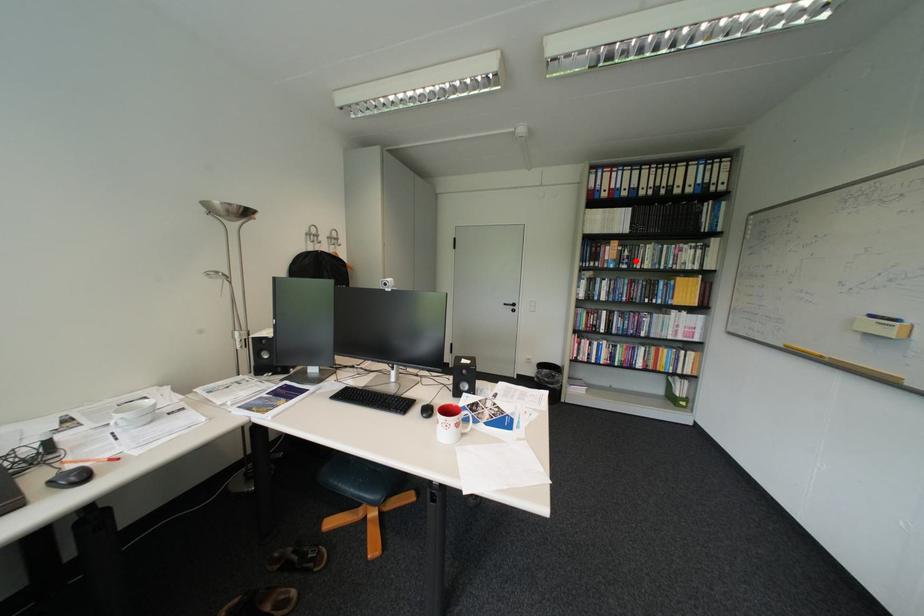
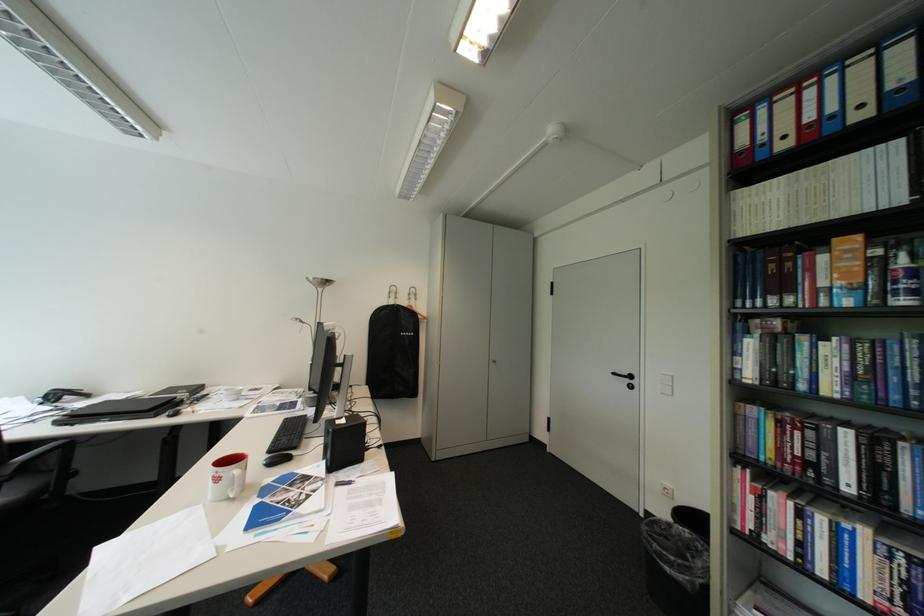
The point at the highlighted location is marked in the first image. Where is the corresponding point in the second image?

(907, 284)